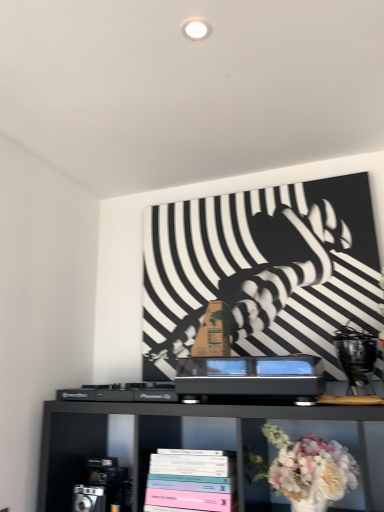
Question: Considering the relative sizes of pastel matte books at lower center and pastel floral bouquet at lower right in the image provided, is pastel matte books at lower center bigger than pastel floral bouquet at lower right?

Choices:
 (A) no
 (B) yes

Answer: (B)

Question: Is pastel matte books at lower center taller than pastel floral bouquet at lower right?

Choices:
 (A) no
 (B) yes

Answer: (A)

Question: Is pastel matte books at lower center completely or partially outside of pastel floral bouquet at lower right?

Choices:
 (A) yes
 (B) no

Answer: (A)

Question: Considering the relative sizes of pastel matte books at lower center and pastel floral bouquet at lower right in the image provided, is pastel matte books at lower center thinner than pastel floral bouquet at lower right?

Choices:
 (A) no
 (B) yes

Answer: (A)

Question: Does pastel matte books at lower center have a greater width compared to pastel floral bouquet at lower right?

Choices:
 (A) yes
 (B) no

Answer: (A)

Question: Is pastel matte books at lower center smaller than pastel floral bouquet at lower right?

Choices:
 (A) yes
 (B) no

Answer: (B)

Question: Is pastel matte books at lower center inside pastel floral bouquet at lower right?

Choices:
 (A) yes
 (B) no

Answer: (B)

Question: Does pastel floral bouquet at lower right have a lesser width compared to pastel matte books at lower center?

Choices:
 (A) yes
 (B) no

Answer: (A)

Question: Considering the relative sizes of pastel floral bouquet at lower right and pastel matte books at lower center in the image provided, is pastel floral bouquet at lower right bigger than pastel matte books at lower center?

Choices:
 (A) no
 (B) yes

Answer: (A)

Question: Would you say pastel floral bouquet at lower right is a long distance from pastel matte books at lower center?

Choices:
 (A) yes
 (B) no

Answer: (B)

Question: From the image's perspective, is pastel floral bouquet at lower right above pastel matte books at lower center?

Choices:
 (A) yes
 (B) no

Answer: (A)

Question: From a real-world perspective, is pastel floral bouquet at lower right beneath pastel matte books at lower center?

Choices:
 (A) yes
 (B) no

Answer: (B)

Question: Is pastel floral bouquet at lower right spatially inside pastel matte books at lower center, or outside of it?

Choices:
 (A) outside
 (B) inside

Answer: (A)